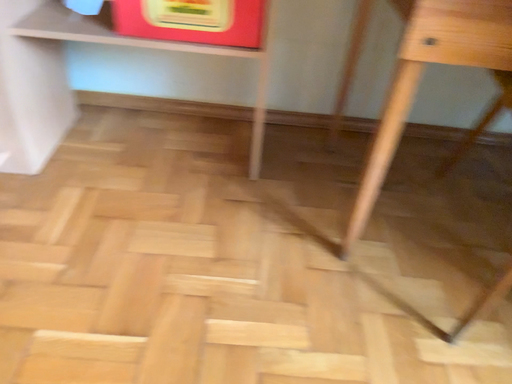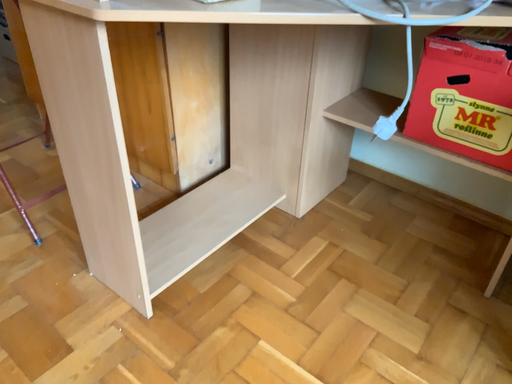
Question: How did the camera likely rotate when shooting the video?

Choices:
 (A) rotated upward
 (B) rotated downward

Answer: (A)